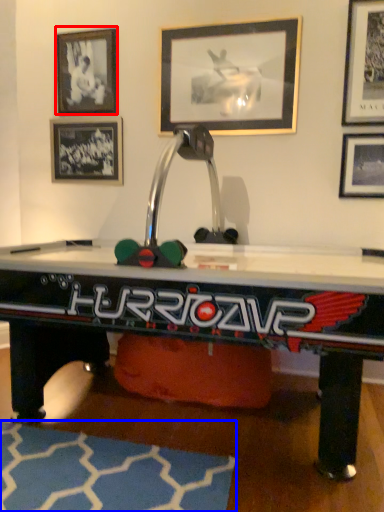
Question: Which object appears farthest to the camera in this image, picture frame (highlighted by a red box) or mat (highlighted by a blue box)?

Choices:
 (A) picture frame
 (B) mat

Answer: (A)